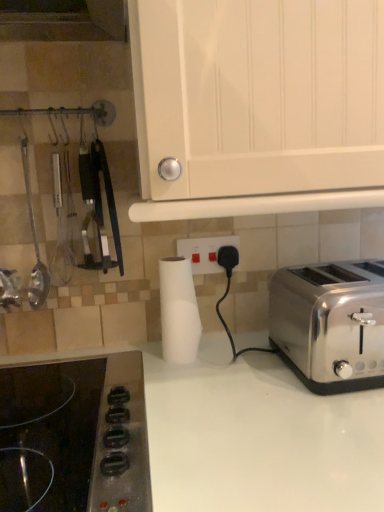
Question: Are white matte paper towel at center and white glossy cabinet at upper center far apart?

Choices:
 (A) no
 (B) yes

Answer: (A)

Question: Considering the relative sizes of white matte paper towel at center and white glossy cabinet at upper center in the image provided, is white matte paper towel at center wider than white glossy cabinet at upper center?

Choices:
 (A) yes
 (B) no

Answer: (B)

Question: From a real-world perspective, is white matte paper towel at center over white glossy cabinet at upper center?

Choices:
 (A) yes
 (B) no

Answer: (B)

Question: Are white matte paper towel at center and white glossy cabinet at upper center beside each other?

Choices:
 (A) no
 (B) yes

Answer: (A)

Question: From a real-world perspective, is white matte paper towel at center physically below white glossy cabinet at upper center?

Choices:
 (A) no
 (B) yes

Answer: (B)

Question: From the image's perspective, is white matte paper towel at center above or below black glass cooktop at lower left?

Choices:
 (A) below
 (B) above

Answer: (B)

Question: Considering the positions of point (165, 308) and point (18, 424), is point (165, 308) closer or farther from the camera than point (18, 424)?

Choices:
 (A) farther
 (B) closer

Answer: (A)

Question: Is white matte paper towel at center in front of or behind black glass cooktop at lower left in the image?

Choices:
 (A) behind
 (B) front

Answer: (A)

Question: Is white matte paper towel at center inside or outside of black glass cooktop at lower left?

Choices:
 (A) inside
 (B) outside

Answer: (B)

Question: Considering the positions of white matte paper towel at center and metallic silver ladle at left in the image, is white matte paper towel at center taller or shorter than metallic silver ladle at left?

Choices:
 (A) tall
 (B) short

Answer: (B)

Question: Is white matte paper towel at center inside or outside of metallic silver ladle at left?

Choices:
 (A) outside
 (B) inside

Answer: (A)

Question: Relative to metallic silver ladle at left, is white matte paper towel at center in front or behind?

Choices:
 (A) behind
 (B) front

Answer: (A)

Question: In terms of size, does white matte paper towel at center appear bigger or smaller than metallic silver ladle at left?

Choices:
 (A) big
 (B) small

Answer: (A)

Question: Is satin silver toaster at right spatially inside black glass cooktop at lower left, or outside of it?

Choices:
 (A) outside
 (B) inside

Answer: (A)

Question: Considering the positions of satin silver toaster at right and black glass cooktop at lower left in the image, is satin silver toaster at right bigger or smaller than black glass cooktop at lower left?

Choices:
 (A) big
 (B) small

Answer: (A)